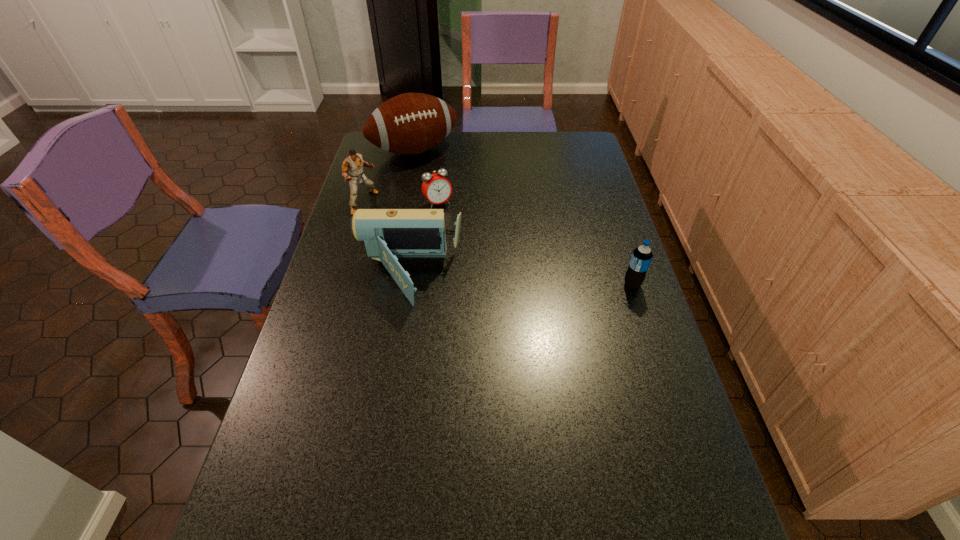
Find the location of a particular element. This screenshot has width=960, height=540. free spot on the desktop that is between the camcorder and the soda bottle and is positioned on the front-facing side of the puncher is located at coordinates (520, 281).

Find the location of a particular element. The height and width of the screenshot is (540, 960). free space on the desktop that is between the camcorder and the rightmost object and is positioned on the laces of the football is located at coordinates (502, 280).

The width and height of the screenshot is (960, 540). Identify the location of free spot on the desktop that is between the camcorder and the soda bottle and is positioned on the front-facing side of the alarm clock. (492, 280).